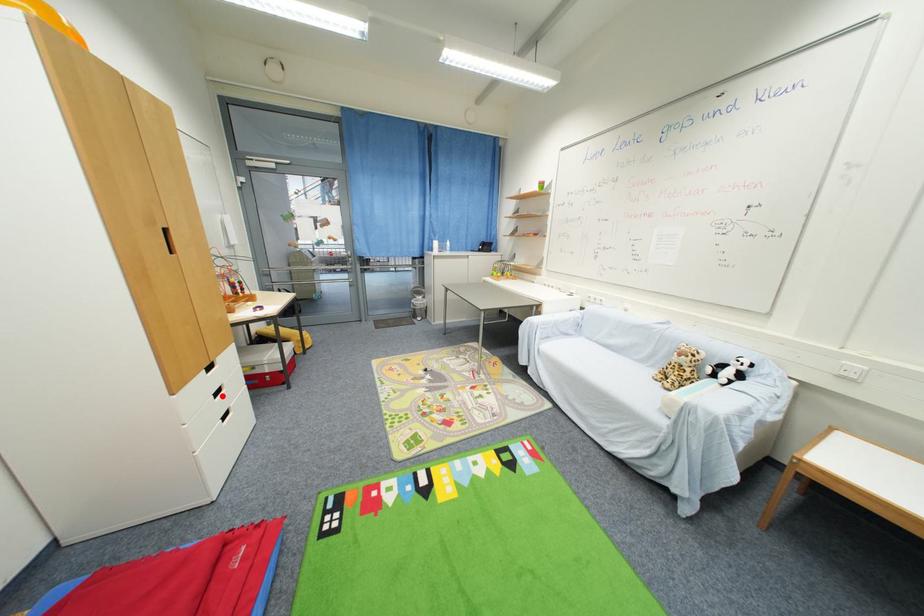
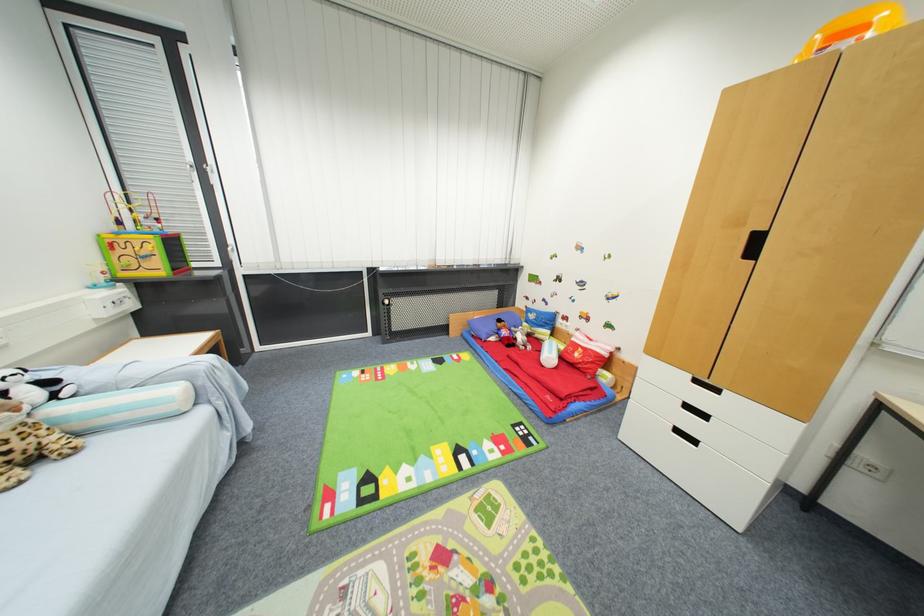
Question: I am providing you with two images of the same scene from different viewpoints. Given a red point in image1, look at the same physical point in image2. Is it:

Choices:
 (A) Closer to the viewpoint
 (B) Farther from the viewpoint

Answer: (B)